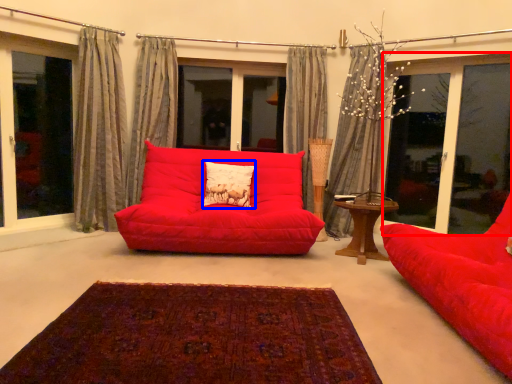
Question: Among these objects, which one is farthest to the camera, window (highlighted by a red box) or pillow (highlighted by a blue box)?

Choices:
 (A) window
 (B) pillow

Answer: (B)